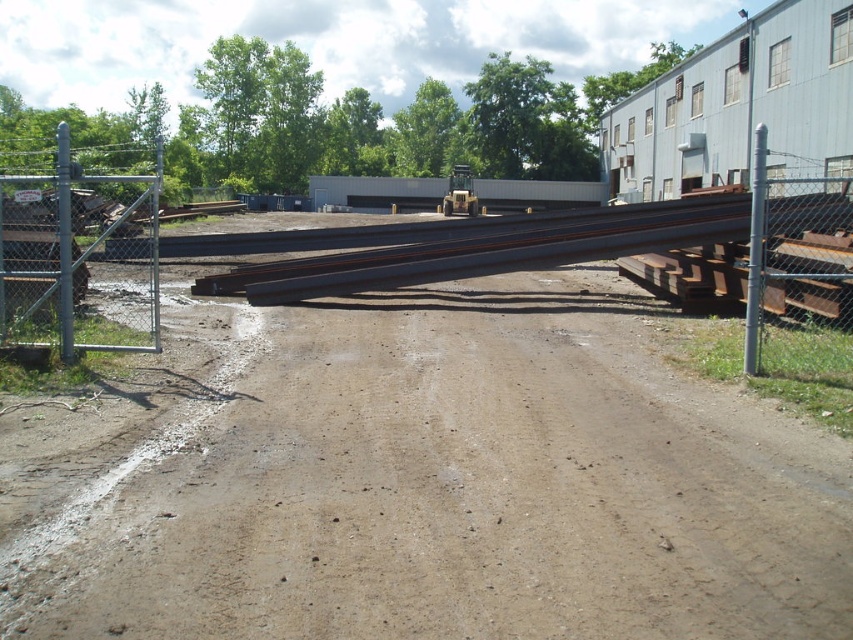
Question: Which of the following is the closest to the observer?

Choices:
 (A) brown dirt track at center
 (B) rusty metal train track at center

Answer: (A)

Question: Is the position of rusty metal train track at center less distant than that of gray metallic pole at right?

Choices:
 (A) no
 (B) yes

Answer: (A)

Question: Does rusty metal train track at center come behind silver chain-link fence at left?

Choices:
 (A) yes
 (B) no

Answer: (A)

Question: Which object appears closest to the camera in this image?

Choices:
 (A) gray chain-link fence at right
 (B) rusty metal train track at center
 (C) brown dirt track at center

Answer: (C)

Question: Is rusty metal train track at center wider than gray metallic pole at right?

Choices:
 (A) yes
 (B) no

Answer: (A)

Question: Which object is the closest to the gray chain-link fence at right?

Choices:
 (A) silver chain-link fence at left
 (B) gray metallic pole at right
 (C) rusty metal train track at center

Answer: (B)